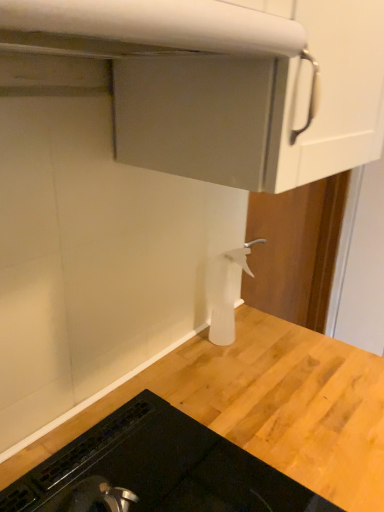
Where is `free space underneath white matte exhaust hood at upper center (from a real-world perspective)`? This screenshot has width=384, height=512. free space underneath white matte exhaust hood at upper center (from a real-world perspective) is located at coordinates (91, 450).